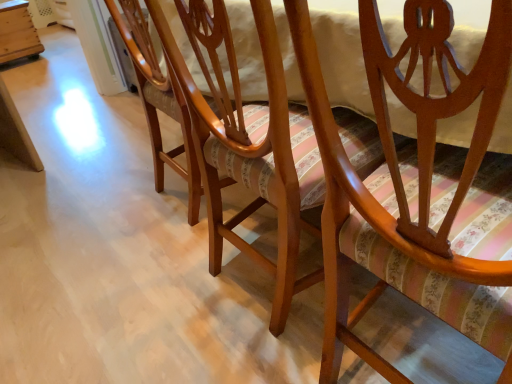
This screenshot has width=512, height=384. In order to click on matte wood chair at center, placed as the second chair when sorted from back to front in this screenshot , I will do `click(389, 242)`.

Describe the element at coordinates (159, 101) in the screenshot. I see `wooden chair at center, which ranks as the 1th chair in back-to-front order` at that location.

Describe the element at coordinates (17, 32) in the screenshot. I see `wooden crate at left` at that location.

Identify the location of matte wood chair at center, which is counted as the 2th chair, starting from the left. The height and width of the screenshot is (384, 512). (389, 242).

From a real-world perspective, is wooden crate at left below wooden chair at center, the 2th chair positioned from the right?

Indeed, from a real-world perspective, wooden crate at left is positioned beneath wooden chair at center, the 2th chair positioned from the right.

Looking at this image, is wooden crate at left positioned behind wooden chair at center, which ranks as the 1th chair in back-to-front order?

Yes, it is behind wooden chair at center, which ranks as the 1th chair in back-to-front order.

Locate an element on the screen. The height and width of the screenshot is (384, 512). table behind the wooden chair at center, which is the 2th chair from front to back is located at coordinates (17, 32).

Considering the sizes of objects wooden crate at left and wooden chair at center, which is the 2th chair from front to back, in the image provided, who is smaller, wooden crate at left or wooden chair at center, which is the 2th chair from front to back,?

With smaller size is wooden crate at left.

From the picture: From a real-world perspective, is matte wood chair at center, the first chair when ordered from front to back, physically located above or below wooden crate at left?

Clearly, from a real-world perspective, matte wood chair at center, the first chair when ordered from front to back, is above wooden crate at left.

Identify the location of table below the matte wood chair at center, which is the 1th chair in right-to-left order (from a real-world perspective). The height and width of the screenshot is (384, 512). (17, 32).

Is matte wood chair at center, which is the 1th chair in right-to-left order, spatially inside wooden crate at left, or outside of it?

matte wood chair at center, which is the 1th chair in right-to-left order, is located beyond the bounds of wooden crate at left.

Does point (376, 98) come closer to viewer compared to point (3, 4)?

Yes, it is in front of point (3, 4).

Relative to matte wood chair at center, which is counted as the 2th chair, starting from the left, is wooden chair at center, positioned as the 1th chair in left-to-right order, in front or behind?

wooden chair at center, positioned as the 1th chair in left-to-right order, is positioned farther from the viewer than matte wood chair at center, which is counted as the 2th chair, starting from the left.

Is point (155, 142) closer to camera compared to point (458, 96)?

That is False.

Is wooden chair at center, which ranks as the 1th chair in back-to-front order, positioned far away from matte wood chair at center, which is the 1th chair in right-to-left order?

wooden chair at center, which ranks as the 1th chair in back-to-front order, is near matte wood chair at center, which is the 1th chair in right-to-left order, not far away.

Who is smaller, wooden chair at center, which ranks as the 1th chair in back-to-front order, or matte wood chair at center, placed as the second chair when sorted from back to front?

With smaller size is wooden chair at center, which ranks as the 1th chair in back-to-front order.

Between matte wood chair at center, which is the 1th chair in right-to-left order, and wooden chair at center, positioned as the 1th chair in left-to-right order, which one appears on the left side from the viewer's perspective?

From the viewer's perspective, wooden chair at center, positioned as the 1th chair in left-to-right order, appears more on the left side.

Is the position of matte wood chair at center, the first chair when ordered from front to back, less distant than that of wooden chair at center, the 2th chair positioned from the right?

Yes, it is in front of wooden chair at center, the 2th chair positioned from the right.

Which point is more distant from viewer, (372,244) or (188,134)?

The point (188,134) is behind.

Considering the positions of objects wooden chair at center, which ranks as the 1th chair in back-to-front order, and wooden crate at left in the image provided, who is behind, wooden chair at center, which ranks as the 1th chair in back-to-front order, or wooden crate at left?

wooden crate at left is further away from the camera.

Is wooden chair at center, the 2th chair positioned from the right, oriented towards wooden crate at left?

No, wooden chair at center, the 2th chair positioned from the right, is not facing towards wooden crate at left.

Considering the relative positions of wooden chair at center, which is the 2th chair from front to back, and wooden crate at left in the image provided, is wooden chair at center, which is the 2th chair from front to back, to the right of wooden crate at left from the viewer's perspective?

Yes, wooden chair at center, which is the 2th chair from front to back, is to the right of wooden crate at left.

How much distance is there between wooden chair at center, positioned as the 1th chair in left-to-right order, and wooden crate at left?

They are 9.71 feet apart.

Which object is closer to the camera, wooden crate at left or matte wood chair at center, which is counted as the 2th chair, starting from the left?

matte wood chair at center, which is counted as the 2th chair, starting from the left, is more forward.

Which is more to the right, wooden crate at left or matte wood chair at center, the first chair when ordered from front to back?

matte wood chair at center, the first chair when ordered from front to back, is more to the right.

Considering the sizes of wooden crate at left and matte wood chair at center, which is the 1th chair in right-to-left order, in the image, is wooden crate at left taller or shorter than matte wood chair at center, which is the 1th chair in right-to-left order,?

wooden crate at left is shorter than matte wood chair at center, which is the 1th chair in right-to-left order.

Considering the points (25, 41) and (386, 76), which point is behind, point (25, 41) or point (386, 76)?

The point (25, 41) is more distant.

Locate an element on the screen. The height and width of the screenshot is (384, 512). table beneath the wooden chair at center, positioned as the 1th chair in left-to-right order (from a real-world perspective) is located at coordinates (17, 32).

The width and height of the screenshot is (512, 384). In order to click on chair that is the 2nd one when counting downward from the wooden crate at left (from the image's perspective) in this screenshot , I will do `click(389, 242)`.

Considering their positions, is matte wood chair at center, which is counted as the 2th chair, starting from the left, positioned further to wooden chair at center, which ranks as the 1th chair in back-to-front order, than wooden crate at left?

wooden crate at left is positioned further to the anchor wooden chair at center, which ranks as the 1th chair in back-to-front order.

Looking at the image, which one is located closer to wooden crate at left, wooden chair at center, the 2th chair positioned from the right, or matte wood chair at center, which is counted as the 2th chair, starting from the left?

wooden chair at center, the 2th chair positioned from the right, is closer to wooden crate at left.

Which object lies further to the anchor point wooden chair at center, positioned as the 1th chair in left-to-right order, wooden crate at left or matte wood chair at center, which is the 1th chair in right-to-left order?

wooden crate at left is positioned further to the anchor wooden chair at center, positioned as the 1th chair in left-to-right order.

Based on their spatial positions, is wooden chair at center, which ranks as the 1th chair in back-to-front order, or wooden crate at left closer to matte wood chair at center, which is the 1th chair in right-to-left order?

wooden chair at center, which ranks as the 1th chair in back-to-front order, is closer to matte wood chair at center, which is the 1th chair in right-to-left order.

Estimate the real-world distances between objects in this image. Which object is further from matte wood chair at center, which is the 1th chair in right-to-left order, wooden crate at left or wooden chair at center, which is the 2th chair from front to back?

Based on the image, wooden crate at left appears to be further to matte wood chair at center, which is the 1th chair in right-to-left order.

Considering their positions, is matte wood chair at center, which is counted as the 2th chair, starting from the left, positioned further to wooden crate at left than wooden chair at center, which ranks as the 1th chair in back-to-front order?

matte wood chair at center, which is counted as the 2th chair, starting from the left, is further to wooden crate at left.

Where is `chair located between matte wood chair at center, placed as the second chair when sorted from back to front, and wooden crate at left in the depth direction`? The image size is (512, 384). chair located between matte wood chair at center, placed as the second chair when sorted from back to front, and wooden crate at left in the depth direction is located at coordinates (159, 101).